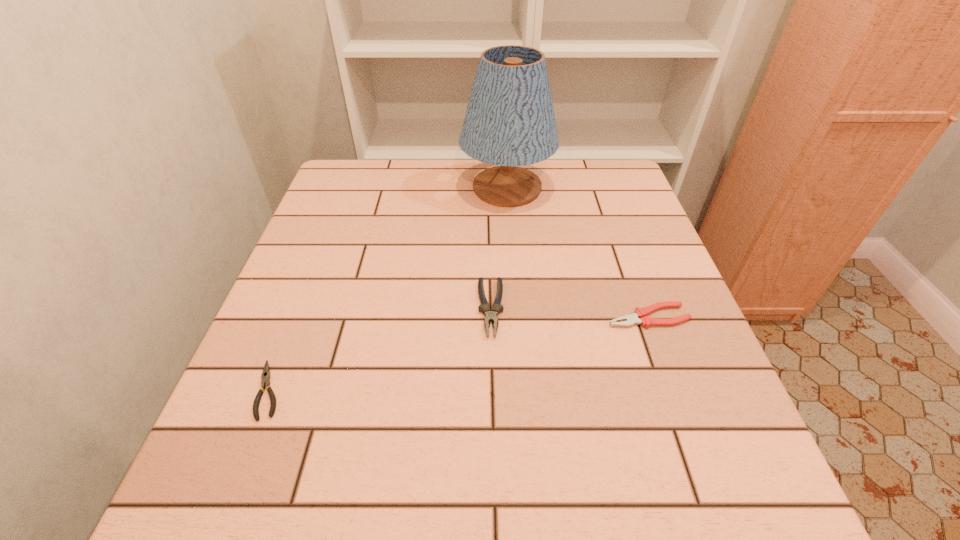
Where is `lampshade`? lampshade is located at coordinates (510, 121).

Identify the location of the tallest object. (510, 121).

Image resolution: width=960 pixels, height=540 pixels. I want to click on the tallest pliers, so click(484, 308).

Find the location of `the second pliers from left to right`. the second pliers from left to right is located at coordinates (484, 308).

The image size is (960, 540). I want to click on the rightmost object, so click(x=639, y=316).

Identify the location of the third tallest object. The height and width of the screenshot is (540, 960). (639, 316).

Locate an element on the screen. The width and height of the screenshot is (960, 540). the leftmost object is located at coordinates (266, 375).

The image size is (960, 540). Find the location of `the nearest pliers`. the nearest pliers is located at coordinates (266, 375).

Locate an element on the screen. This screenshot has height=540, width=960. vacant space located on the front of the lampshade is located at coordinates (518, 336).

At what (x,y) coordinates should I click in order to perform the action: click on vacant space located at the gripping part of the second pliers from right to left. Please return your answer as a coordinate pair (x, y). Looking at the image, I should click on (493, 434).